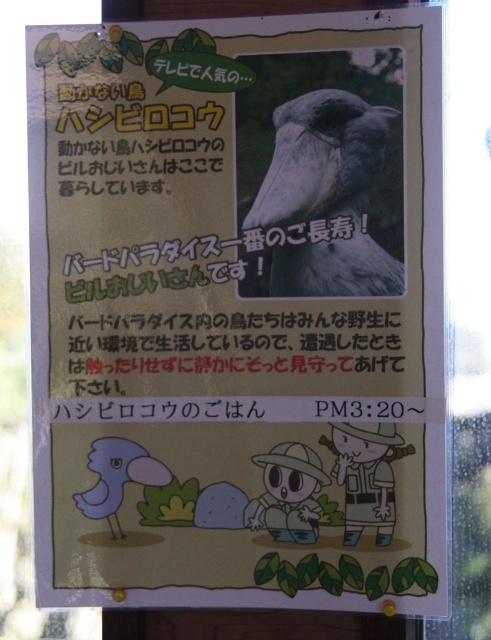
Question: Is gray matte bird at center behind matte blue bird at lower left?

Choices:
 (A) yes
 (B) no

Answer: (B)

Question: Does gray matte bird at center appear on the right side of matte blue bird at lower left?

Choices:
 (A) yes
 (B) no

Answer: (A)

Question: Which point is farther from the camera taking this photo?

Choices:
 (A) (321, 92)
 (B) (89, 490)

Answer: (B)

Question: Is gray matte bird at center positioned in front of matte blue bird at lower left?

Choices:
 (A) yes
 (B) no

Answer: (A)